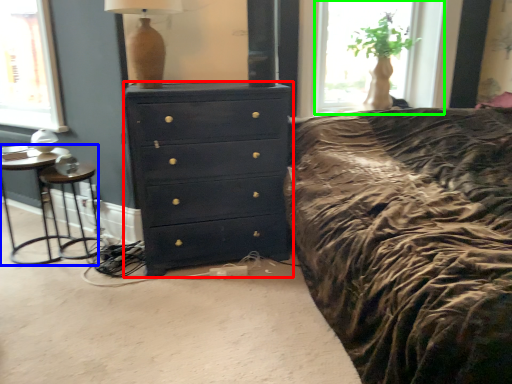
Question: Estimate the real-world distances between objects in this image. Which object is farther from chest of drawers (highlighted by a red box), nightstand (highlighted by a blue box) or window (highlighted by a green box)?

Choices:
 (A) nightstand
 (B) window

Answer: (B)